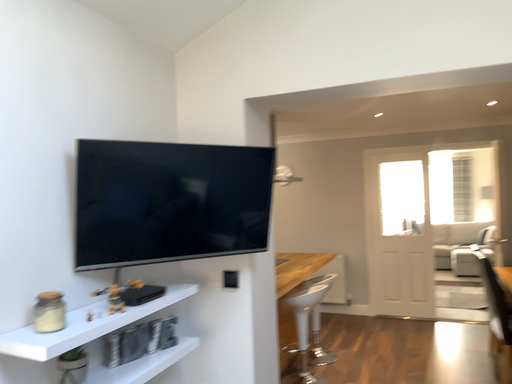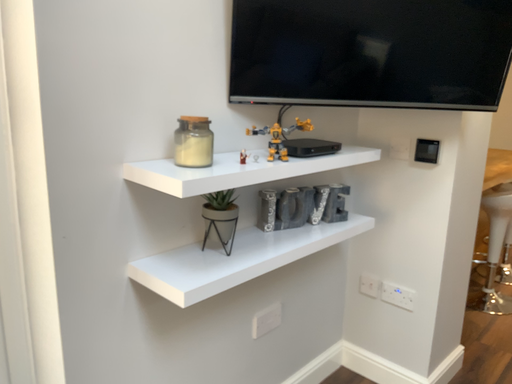
Question: How did the camera likely rotate when shooting the video?

Choices:
 (A) rotated right
 (B) rotated left

Answer: (B)